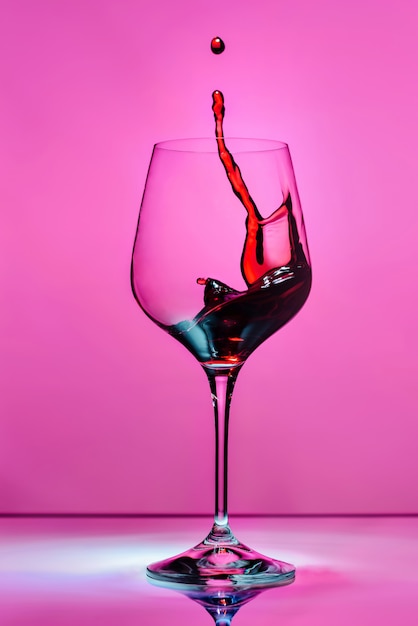
I want to click on the top of glass, so (201, 138).